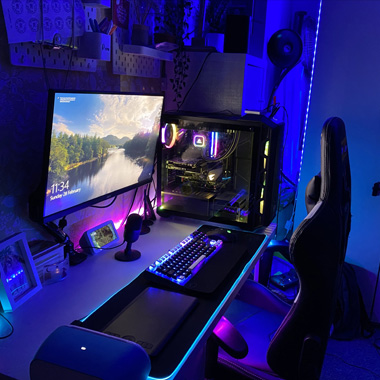
Identify the location of mouse. (218, 230).